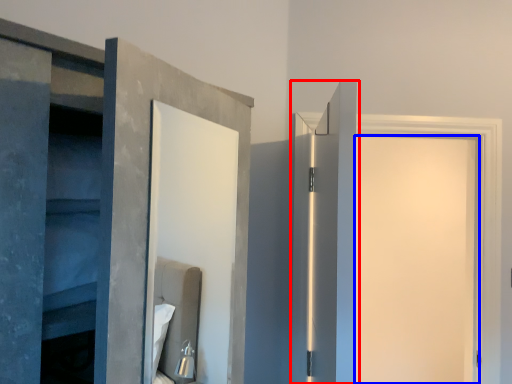
Question: Among these objects, which one is farthest to the camera, door (highlighted by a red box) or door (highlighted by a blue box)?

Choices:
 (A) door
 (B) door

Answer: (B)